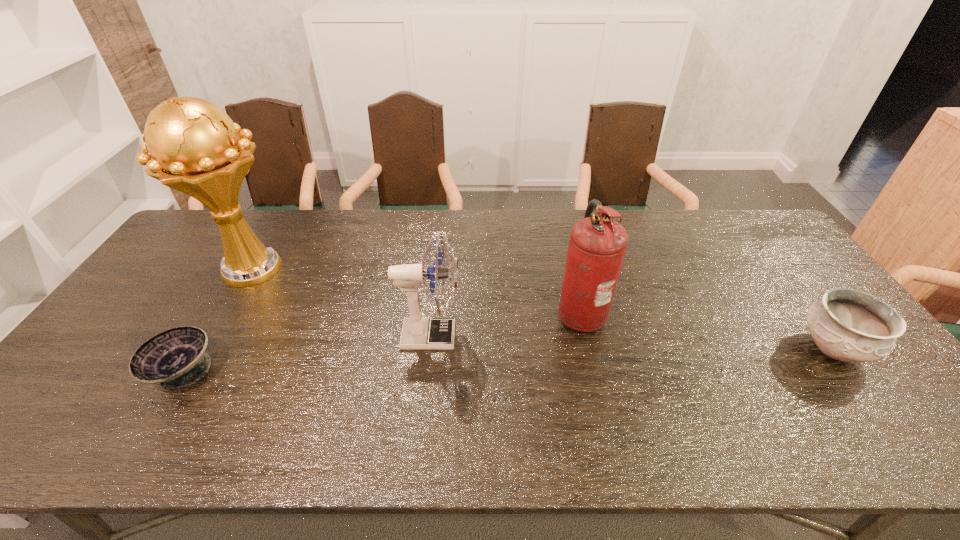
Where is `free location at the near edge of the desktop`? The width and height of the screenshot is (960, 540). free location at the near edge of the desktop is located at coordinates (380, 456).

You are a GUI agent. You are given a task and a screenshot of the screen. Output one action in this format:
    pyautogui.click(x=<x>, y=<y>)
    Task: Click on the free space at the left edge of the desktop
    
    Given the screenshot: What is the action you would take?
    pyautogui.click(x=120, y=397)

Where is `free location at the right edge`? Image resolution: width=960 pixels, height=540 pixels. free location at the right edge is located at coordinates (781, 260).

Find the location of `blank space at the near left corner of the desktop`. blank space at the near left corner of the desktop is located at coordinates (81, 433).

You are a GUI agent. You are given a task and a screenshot of the screen. Output one action in this format:
    pyautogui.click(x=<x>, y=<y>)
    Task: Click on the vacant space at the far right corner of the desktop
    
    Given the screenshot: What is the action you would take?
    pyautogui.click(x=742, y=250)

At what (x,y) coordinates should I click in order to perform the action: click on vacant space that is in between the fourth object from left to right and the fan. Please return your answer as a coordinate pair (x, y). This screenshot has height=540, width=960. Looking at the image, I should click on pos(505,324).

The height and width of the screenshot is (540, 960). In order to click on free spot between the bowl and the trophy_cup in this screenshot , I will do `click(217, 321)`.

This screenshot has height=540, width=960. Identify the location of blank region between the rightmost object and the shortest object. (508, 360).

This screenshot has height=540, width=960. I want to click on blank region between the trophy_cup and the pottery, so click(541, 309).

This screenshot has width=960, height=540. Identify the location of vacant space that is in between the trophy_cup and the shortest object. (217, 321).